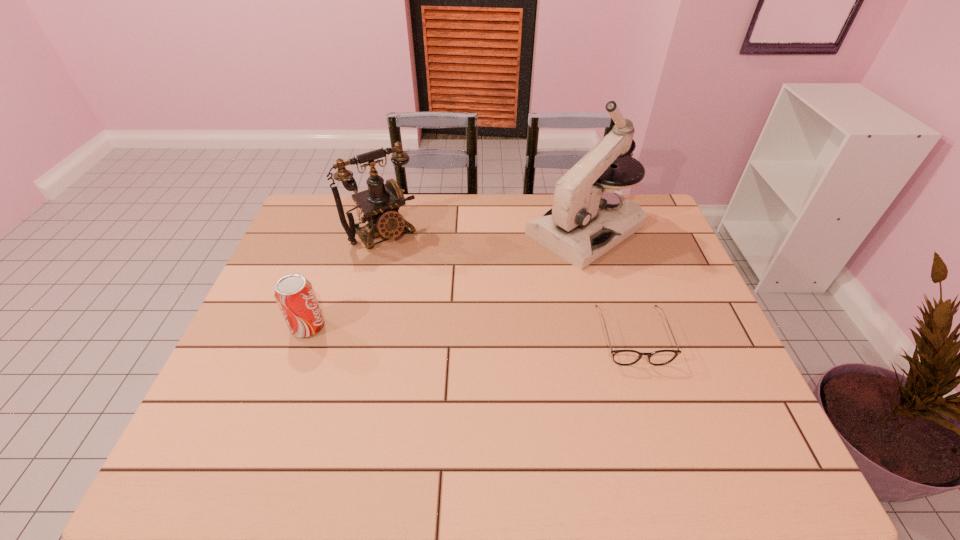
Find the location of a particular element. This screenshot has width=960, height=540. vacant space situated at the eyepiece of the tallest object is located at coordinates (496, 286).

Locate an element on the screen. vacant space located at the eyepiece of the tallest object is located at coordinates (444, 319).

This screenshot has width=960, height=540. Identify the location of telephone that is at the far edge. (380, 203).

Locate an element on the screen. microscope at the far edge is located at coordinates [588, 218].

The image size is (960, 540). Find the location of `object that is at the left edge`. object that is at the left edge is located at coordinates coord(294,294).

Locate an element on the screen. The height and width of the screenshot is (540, 960). spectacles positioned at the right edge is located at coordinates (621, 357).

Identify the location of microscope that is at the right edge. (588, 218).

You are a GUI agent. You are given a task and a screenshot of the screen. Output one action in this format:
    pyautogui.click(x=<x>, y=<y>)
    Task: Click on the object that is at the far right corner
    
    Given the screenshot: What is the action you would take?
    pyautogui.click(x=588, y=218)

The width and height of the screenshot is (960, 540). I want to click on blank space at the far edge, so click(486, 227).

The height and width of the screenshot is (540, 960). In order to click on vacant space at the left edge in this screenshot , I will do `click(265, 372)`.